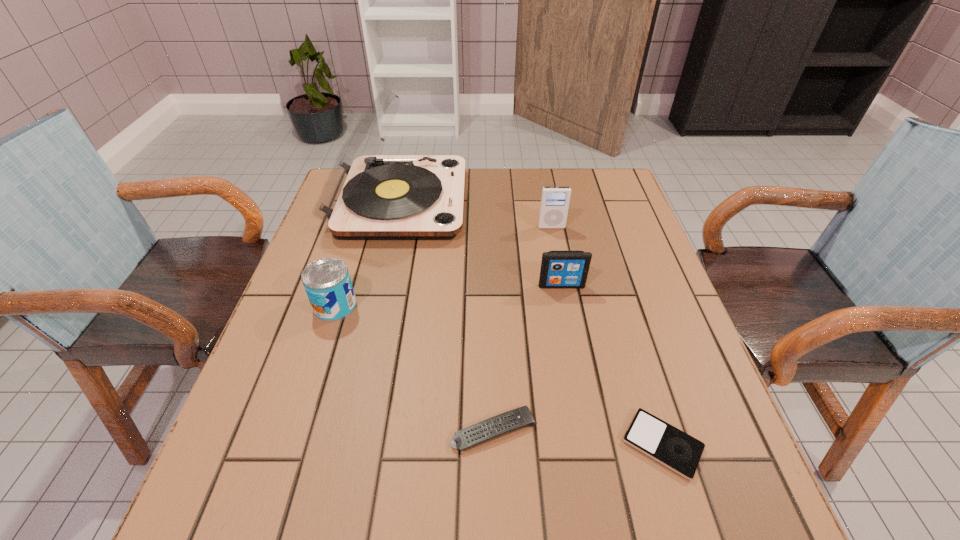
Locate an element on the screen. The height and width of the screenshot is (540, 960). vacant space located 0.090m on the front-facing side of the farthest iPod is located at coordinates (556, 251).

This screenshot has height=540, width=960. Identify the location of free location located 0.210m on the front screen of the second nearest iPod. (576, 362).

At what (x,y) coordinates should I click in order to perform the action: click on free space located on the back of the third nearest object. Please return your answer as a coordinate pair (x, y). The width and height of the screenshot is (960, 540). Looking at the image, I should click on (357, 237).

Identify the location of free spot located on the back of the remote control. This screenshot has width=960, height=540. (491, 309).

You are a GUI agent. You are given a task and a screenshot of the screen. Output one action in this format:
    pyautogui.click(x=<x>, y=<y>)
    Task: Click on the blank space located 0.140m on the back of the nearest iPod
    Image resolution: width=960 pixels, height=540 pixels.
    Given the screenshot: What is the action you would take?
    pyautogui.click(x=634, y=350)

The width and height of the screenshot is (960, 540). In order to click on object situated at the far edge in this screenshot , I will do `click(366, 196)`.

You are a GUI agent. You are given a task and a screenshot of the screen. Output one action in this format:
    pyautogui.click(x=<x>, y=<y>)
    Task: Click on the object present at the near edge
    Image resolution: width=960 pixels, height=540 pixels.
    Given the screenshot: What is the action you would take?
    pyautogui.click(x=678, y=451)

The height and width of the screenshot is (540, 960). Find the location of `record player that is positioned at the left edge`. record player that is positioned at the left edge is located at coordinates (366, 196).

Identify the location of can that is at the left edge. The height and width of the screenshot is (540, 960). (327, 282).

Identify the location of object at the right edge. Image resolution: width=960 pixels, height=540 pixels. (678, 451).